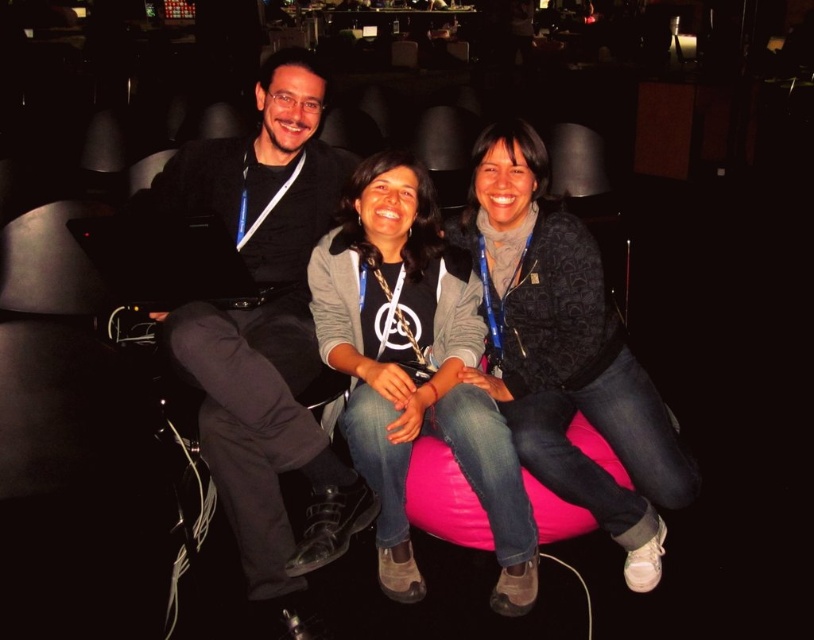
Question: Which object is farther from the camera taking this photo?

Choices:
 (A) black matte jacket at upper left
 (B) pink fabric bean bag at center

Answer: (B)

Question: Is matte black jacket at center thinner than pink fabric bean bag at center?

Choices:
 (A) yes
 (B) no

Answer: (A)

Question: Can you confirm if black matte jacket at upper left is bigger than pink fabric bean bag at center?

Choices:
 (A) yes
 (B) no

Answer: (A)

Question: Estimate the real-world distances between objects in this image. Which object is closer to the pink fabric bean bag at center?

Choices:
 (A) matte black jacket at center
 (B) matte black shirt at center
 (C) black matte jacket at upper left

Answer: (A)

Question: Does black matte jacket at upper left have a larger size compared to matte black shirt at center?

Choices:
 (A) no
 (B) yes

Answer: (B)

Question: Which point is closer to the camera?

Choices:
 (A) black matte jacket at upper left
 (B) matte black jacket at center

Answer: (A)